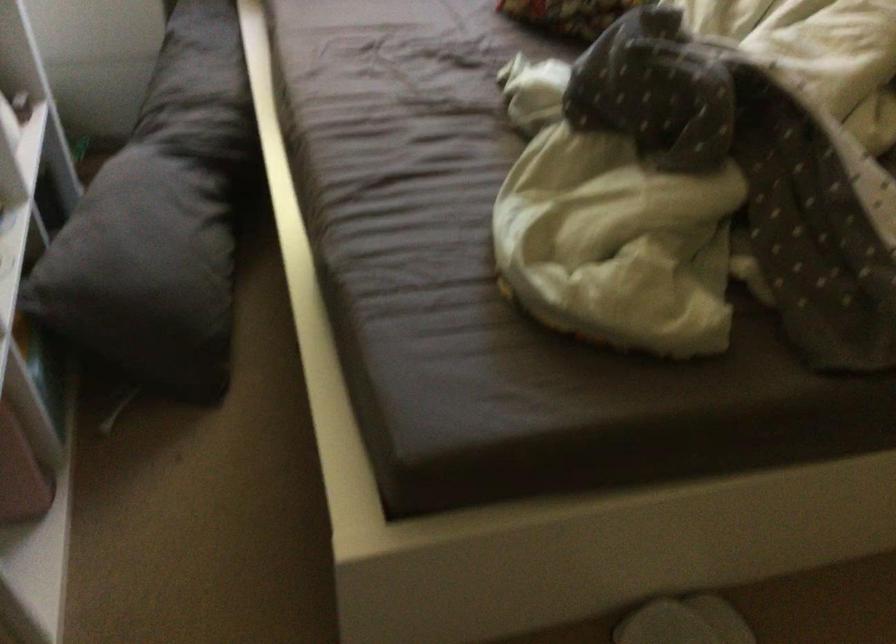
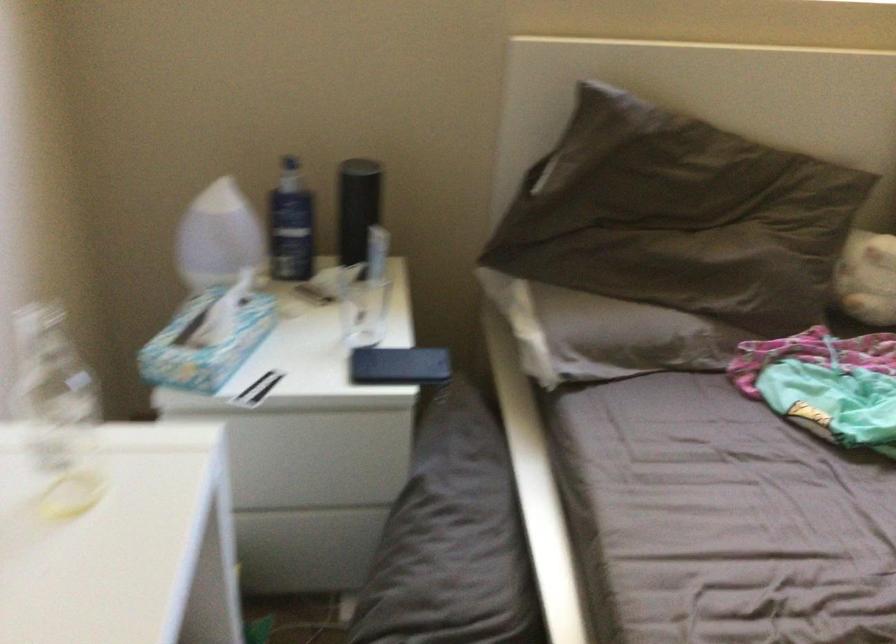
Which direction would the cameraman need to move to produce the second image?

The cameraman walked toward left, forward.